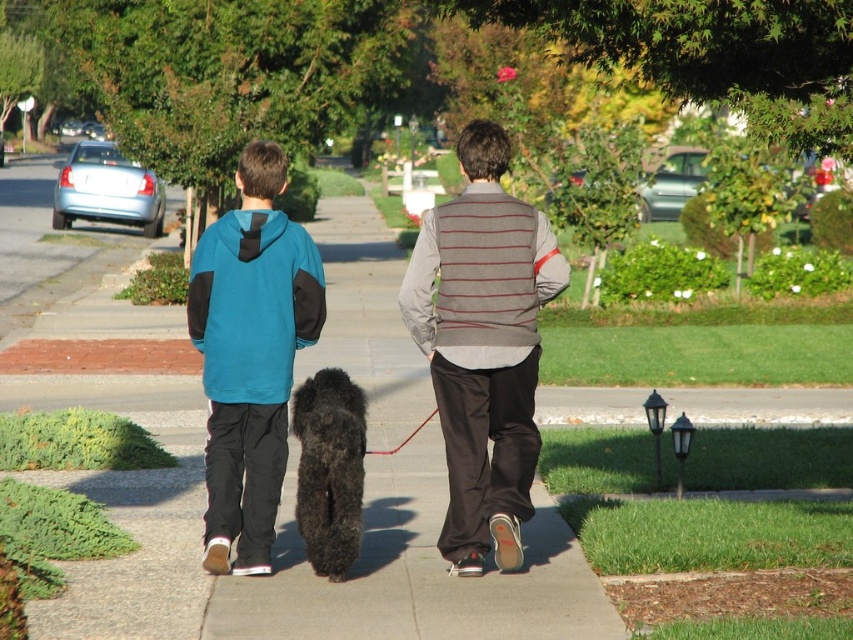
You are a delivery robot that needs to deliver a package to the striped knit vest at center. The coordinates provided are point [483,346]. Can you confirm if this point is the correct location for the striped knit vest at center?

Yes, the point [483,346] corresponds to the striped knit vest at center, so it is the correct location.

You are a delivery robot with a 24 inch wide package. You need to pass between the striped knit vest at center and the black fuzzy dog at center. Can you fit through the space between them?

The distance between the striped knit vest at center and the black fuzzy dog at center is 24.52 inches. Since your package is 24 inches wide, you can fit through the space between them as there is enough clearance.